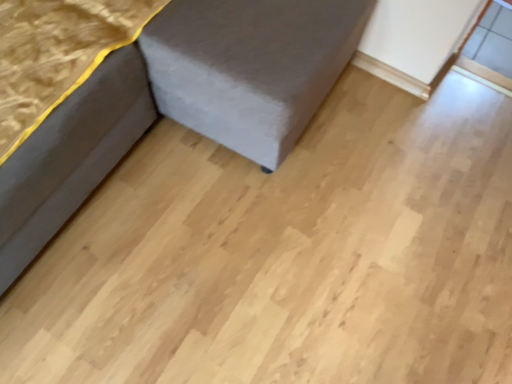
Question: From a real-world perspective, is velvet grey sofa at lower left, the 2th furniture viewed from the left, physically located above or below dark gray fabric at lower left, which ranks as the second furniture in right-to-left order?

Choices:
 (A) above
 (B) below

Answer: (A)

Question: Does point (3, 286) appear closer or farther from the camera than point (60, 196)?

Choices:
 (A) closer
 (B) farther

Answer: (A)

Question: Is velvet grey sofa at lower left, the 2th furniture viewed from the left, inside the boundaries of dark gray fabric at lower left, which ranks as the second furniture in right-to-left order, or outside?

Choices:
 (A) outside
 (B) inside

Answer: (A)

Question: Looking at the image, does dark gray fabric at lower left, which appears as the 1th furniture when viewed from the left, seem bigger or smaller compared to velvet grey sofa at lower left, placed as the first furniture when sorted from right to left?

Choices:
 (A) small
 (B) big

Answer: (A)

Question: Considering the relative positions of dark gray fabric at lower left, which appears as the 1th furniture when viewed from the left, and velvet grey sofa at lower left, the 2th furniture viewed from the left, in the image provided, is dark gray fabric at lower left, which appears as the 1th furniture when viewed from the left, to the left or to the right of velvet grey sofa at lower left, the 2th furniture viewed from the left,?

Choices:
 (A) right
 (B) left

Answer: (B)

Question: From the image's perspective, is dark gray fabric at lower left, which appears as the 1th furniture when viewed from the left, located above or below velvet grey sofa at lower left, placed as the first furniture when sorted from right to left?

Choices:
 (A) below
 (B) above

Answer: (A)

Question: Is dark gray fabric at lower left, which appears as the 1th furniture when viewed from the left, inside the boundaries of velvet grey sofa at lower left, placed as the first furniture when sorted from right to left, or outside?

Choices:
 (A) outside
 (B) inside

Answer: (B)